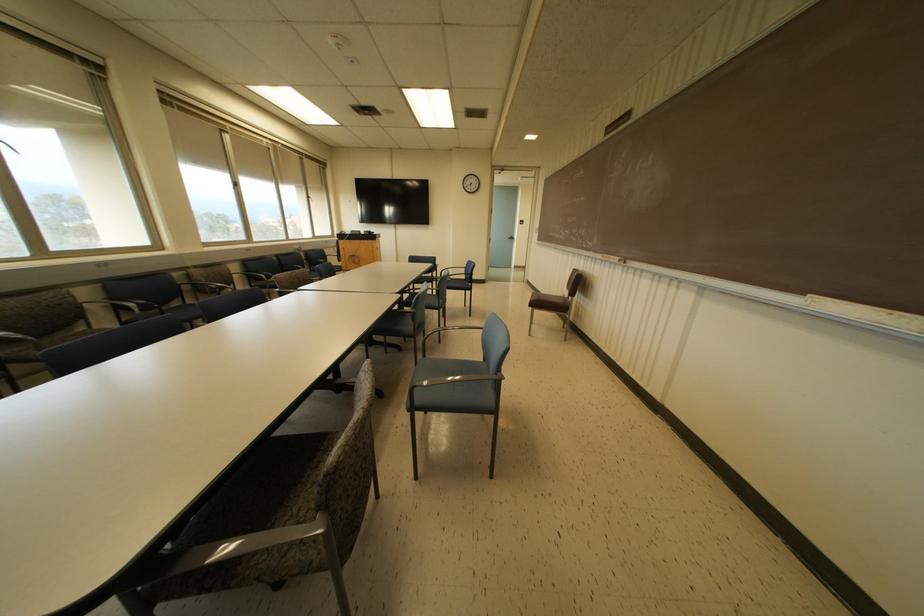
What do you see at coordinates (511, 237) in the screenshot? I see `a door handle` at bounding box center [511, 237].